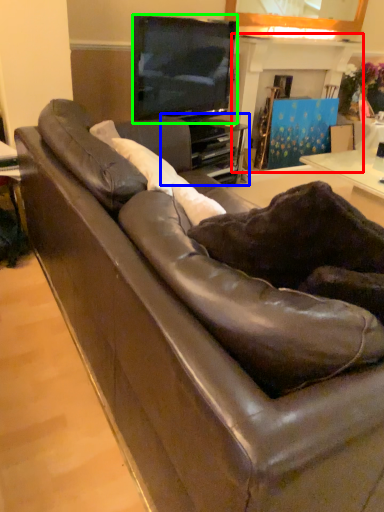
Question: Which object is positioned farthest from fireplace (highlighted by a red box)? Select from entertainment center (highlighted by a blue box) and television (highlighted by a green box).

Choices:
 (A) entertainment center
 (B) television

Answer: (B)